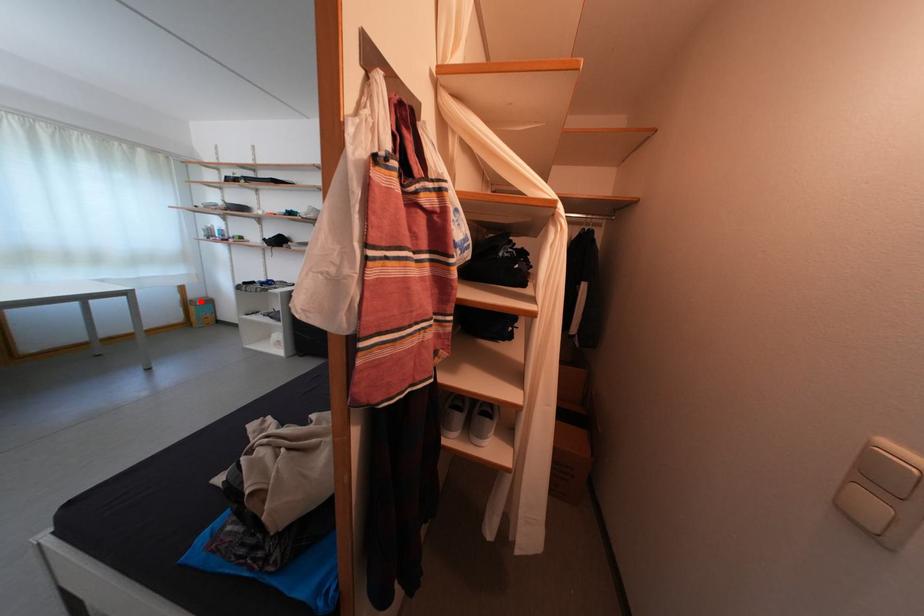
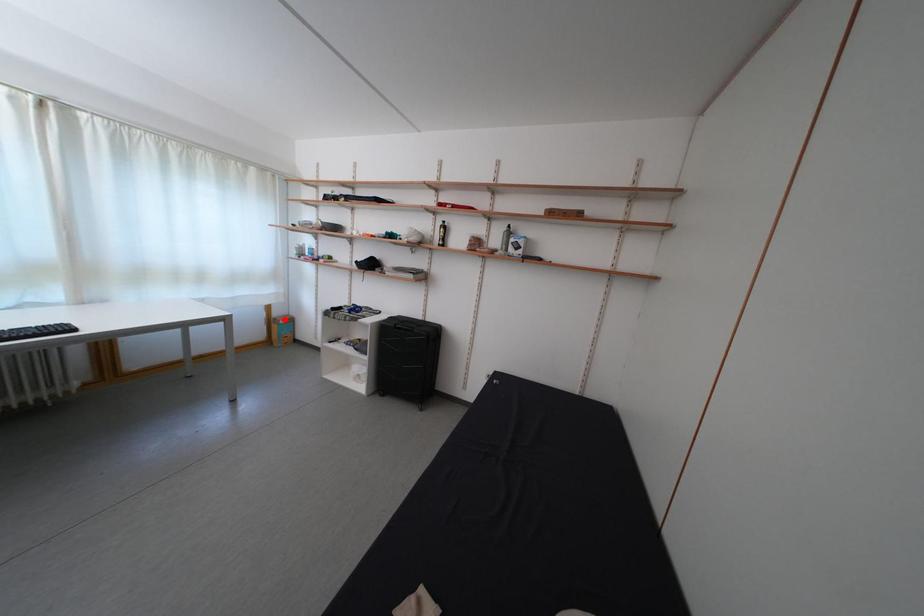
From the picture: I am providing you with two images of the same scene from different viewpoints. A red point is marked on the first image and another point is marked on the second image. Are the points marked in image1 and image2 representing the same 3D position?

Yes